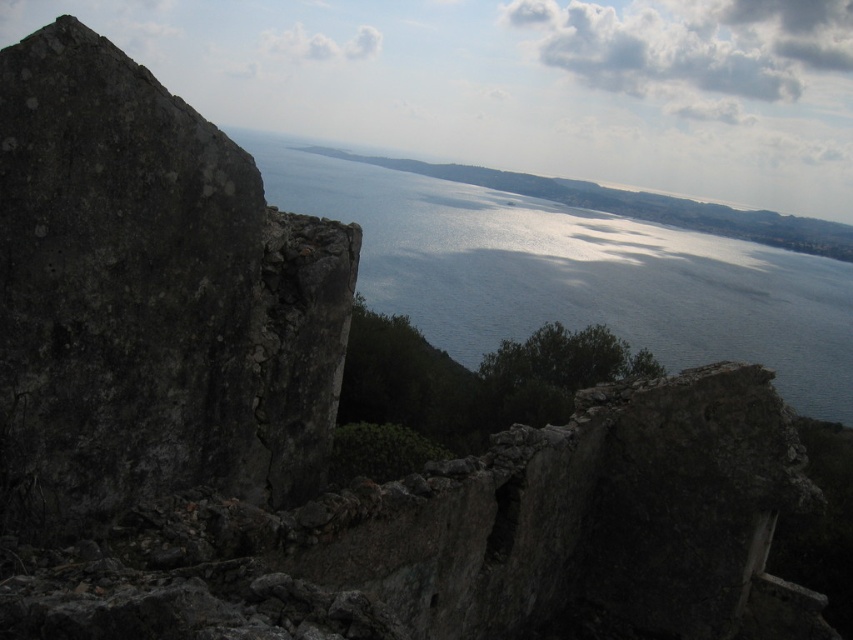
Question: In this image, where is dark gray stone at left located relative to shiny blue water at center?

Choices:
 (A) right
 (B) left

Answer: (B)

Question: Considering the relative positions of dark gray stone at left and shiny blue water at center in the image provided, where is dark gray stone at left located with respect to shiny blue water at center?

Choices:
 (A) right
 (B) left

Answer: (B)

Question: Among these objects, which one is farthest from the camera?

Choices:
 (A) dark gray stone at left
 (B) shiny blue water at center

Answer: (A)

Question: Which point is farther from the camera taking this photo?

Choices:
 (A) (502, 276)
 (B) (299, 333)

Answer: (A)

Question: Which object appears farthest from the camera in this image?

Choices:
 (A) dark gray stone at left
 (B) shiny blue water at center

Answer: (A)

Question: In this image, where is dark gray stone at left located relative to shiny blue water at center?

Choices:
 (A) left
 (B) right

Answer: (A)